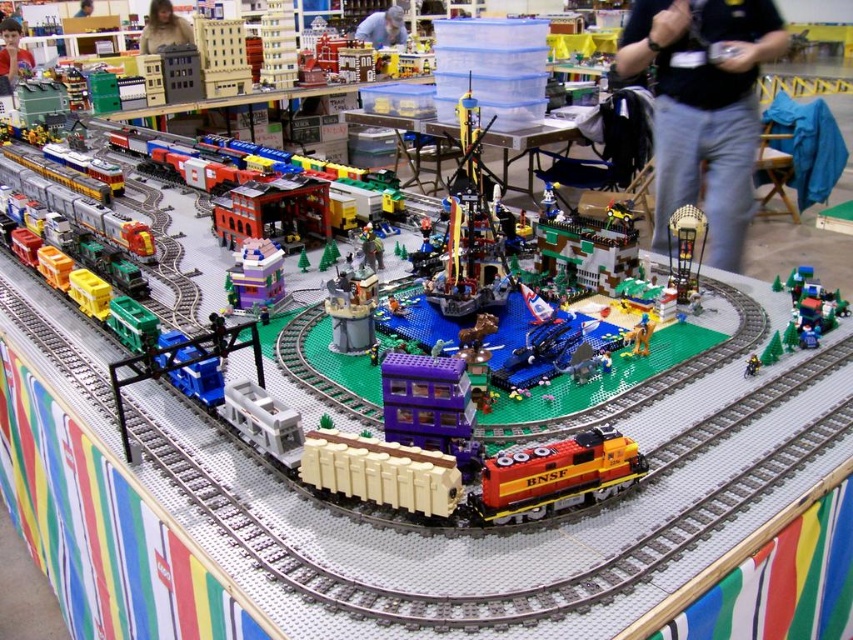
You are a photographer at the Lego train exhibition. You want to take a photo of the two points marked in the scene. Which point, point (372, 304) or point (372, 28), will appear larger in your photo?

Point (372, 304) is closer to the camera than point (372, 28), so it will appear larger in the photo.

You are a visitor at the Lego exhibition and you want to take a photo of the smooth gray tower at center without the smooth skin face at upper left blocking it. How should you adjust your camera angle?

To avoid the smooth skin face at upper left blocking the smooth gray tower at center, you should lower your camera angle since the smooth gray tower at center is positioned under the smooth skin face at upper left.

In the scene shown: You are a Lego figure standing at the base of the smooth gray tower at center and the blue fabric shirt at center. Which object is taller?

The blue fabric shirt at center is taller than the smooth gray tower at center.